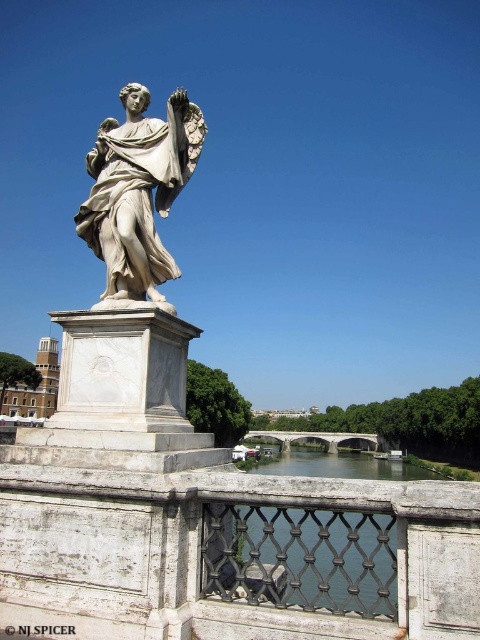
Question: Is clear water at bridge center bigger than white stone bridge at center?

Choices:
 (A) yes
 (B) no

Answer: (A)

Question: Which object is the closest to the white stone bridge at center?

Choices:
 (A) clear water at bridge center
 (B) white marble statue at center

Answer: (A)

Question: Which of the following is the farthest from the observer?

Choices:
 (A) white stone bridge at center
 (B) white marble statue at center

Answer: (A)

Question: Can you confirm if clear water at bridge center is positioned to the right of white stone bridge at center?

Choices:
 (A) yes
 (B) no

Answer: (B)

Question: Which point is closer to the camera taking this photo?

Choices:
 (A) (268, 461)
 (B) (326, 445)

Answer: (A)

Question: Does white marble statue at center have a larger size compared to white stone bridge at center?

Choices:
 (A) no
 (B) yes

Answer: (A)